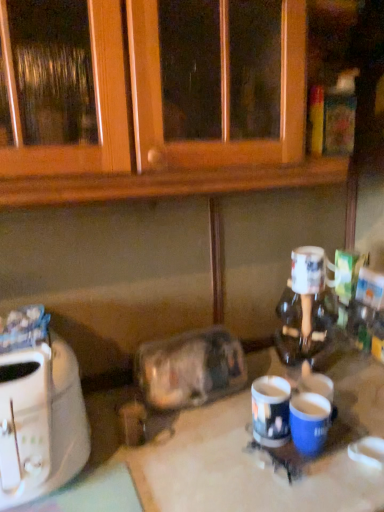
Where is `vacant space positioned to the left of transparent plastic container at center`? vacant space positioned to the left of transparent plastic container at center is located at coordinates (108, 406).